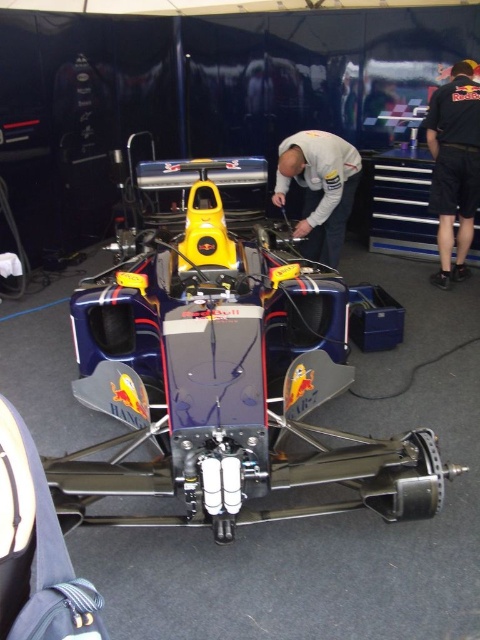
Question: Which of the following is the closest to the observer?

Choices:
 (A) (330, 234)
 (B) (439, 134)

Answer: (A)

Question: Is metallic blue race car at center positioned before white matte shirt at center?

Choices:
 (A) no
 (B) yes

Answer: (B)

Question: Does metallic blue race car at center have a smaller size compared to black fabric pants at right?

Choices:
 (A) no
 (B) yes

Answer: (A)

Question: Is metallic blue race car at center thinner than white matte shirt at center?

Choices:
 (A) yes
 (B) no

Answer: (B)

Question: Based on their relative distances, which object is farther from the white matte shirt at center?

Choices:
 (A) black fabric pants at right
 (B) metallic blue race car at center

Answer: (B)

Question: Among these objects, which one is farthest from the camera?

Choices:
 (A) white matte shirt at center
 (B) black fabric pants at right
 (C) metallic blue race car at center

Answer: (B)